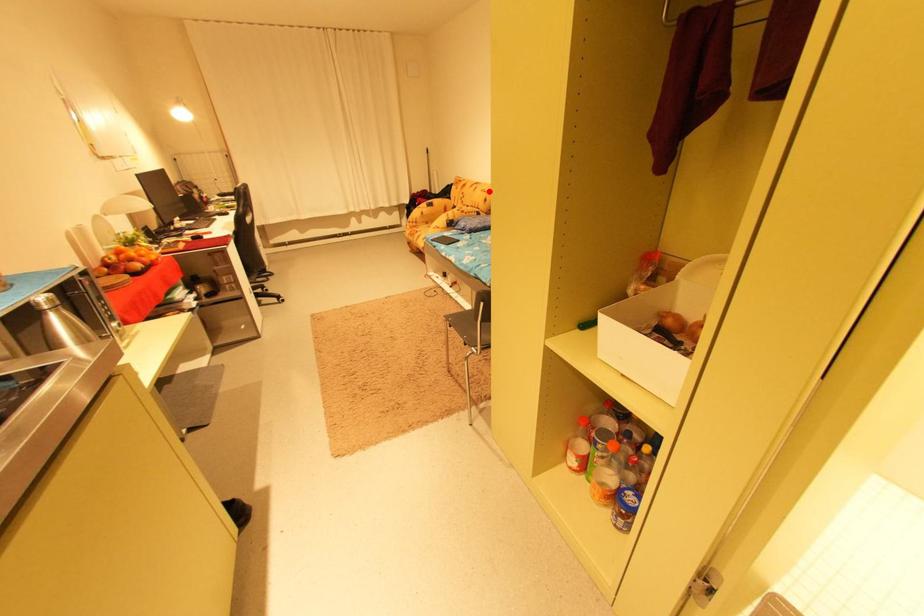
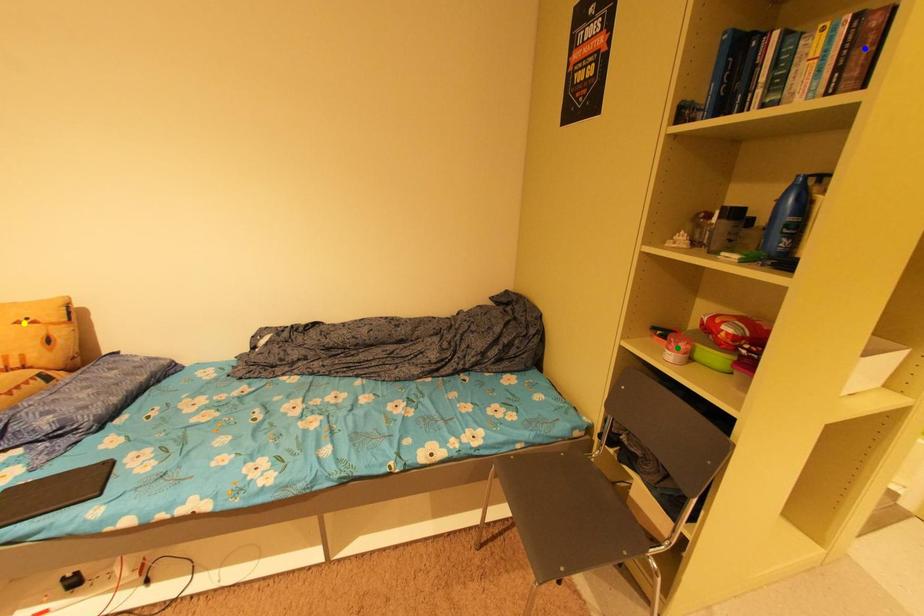
Question: I am providing you with two images of the same scene from different viewpoints. A red point is marked on the first image. You are given multiple points on the second image. Which mark in image 2 goes with the point in image 1?

Choices:
 (A) blue point
 (B) yellow point
 (C) green point

Answer: (B)